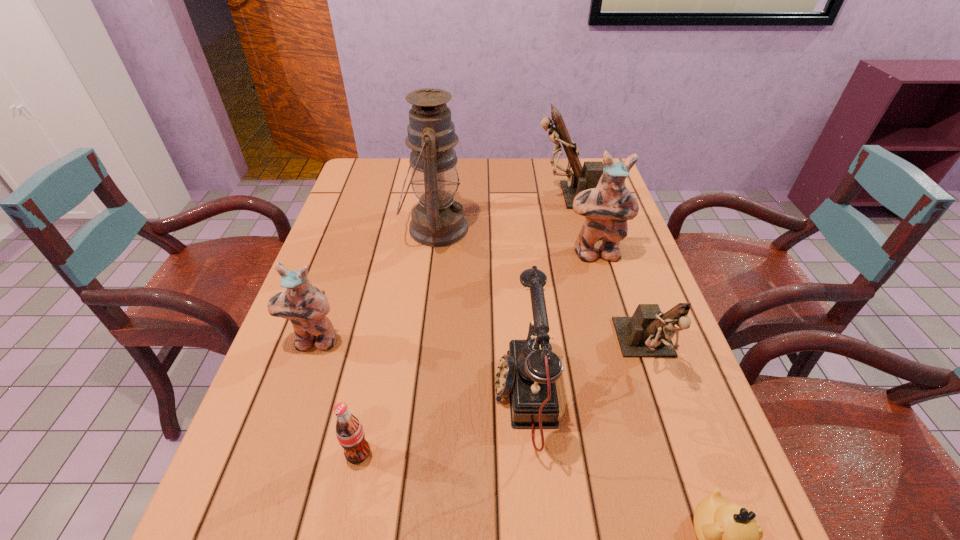
You are a GUI agent. You are given a task and a screenshot of the screen. Output one action in this format:
    pyautogui.click(x=<x>, y=<y>)
    Task: Click on the vacant area situated on the front-facing side of the left pink figurine
    The image size is (960, 540).
    Given the screenshot: What is the action you would take?
    pyautogui.click(x=275, y=453)

Identify the location of vacant space situated 0.100m on the front-facing side of the nearer brown figurine. 676,432.

I want to click on free location located 0.270m on the back of the soda, so click(x=383, y=329).

This screenshot has width=960, height=540. In order to click on object that is at the far edge in this screenshot , I will do `click(587, 177)`.

Locate an element on the screen. object at the left edge is located at coordinates (306, 306).

The height and width of the screenshot is (540, 960). Identify the location of object present at the far right corner. (587, 177).

The height and width of the screenshot is (540, 960). I want to click on vacant space at the far edge of the desktop, so click(489, 169).

This screenshot has width=960, height=540. In order to click on vacant region at the near edge of the desktop in this screenshot , I will do `click(478, 524)`.

The height and width of the screenshot is (540, 960). What are the coordinates of `vacant space at the left edge of the desktop` in the screenshot? It's located at (348, 257).

In order to click on vacant space at the right edge of the desktop in this screenshot , I will do `click(598, 247)`.